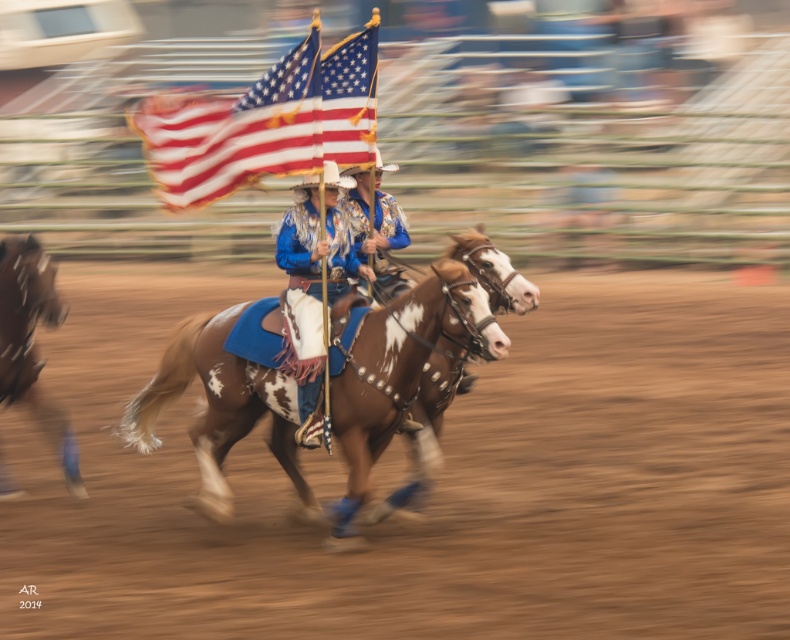
Is brown textured dirt track at center below brown speckled horse at center?

Actually, brown textured dirt track at center is above brown speckled horse at center.

Is point (284, 512) in front of point (241, 358)?

No, it is behind (241, 358).

Does point (747, 547) come farther from viewer compared to point (194, 326)?

No, it is in front of (194, 326).

Find the location of a particular element. Image resolution: width=790 pixels, height=640 pixels. brown textured dirt track at center is located at coordinates (435, 481).

Does brown speckled horse at center appear on the left side of brown speckled horse at left?

In fact, brown speckled horse at center is to the right of brown speckled horse at left.

Does point (356, 332) come farther from viewer compared to point (57, 435)?

No.

Where is `brown speckled horse at center`? Image resolution: width=790 pixels, height=640 pixels. brown speckled horse at center is located at coordinates (392, 376).

Which of these two, blue satin cowboy hat at center or brown speckled horse at left, stands taller?

brown speckled horse at left

Who is lower down, blue satin cowboy hat at center or brown speckled horse at left?

brown speckled horse at left is below.

Is point (310, 429) in front of point (0, 250)?

Yes.

Locate an element on the screen. This screenshot has height=640, width=790. blue satin cowboy hat at center is located at coordinates (313, 285).